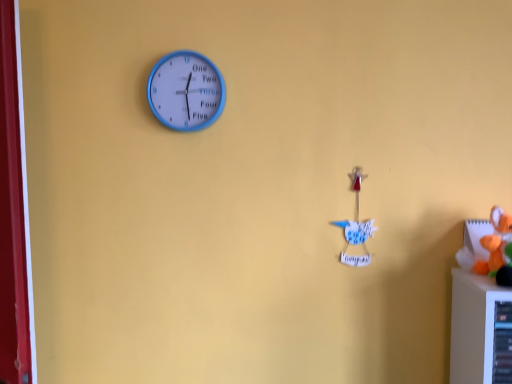
Question: Does blue plastic clock at upper left have a lesser width compared to white paper bird at center-right, which is counted as the first toy, starting from the left?

Choices:
 (A) yes
 (B) no

Answer: (A)

Question: Does blue plastic clock at upper left have a smaller size compared to white paper bird at center-right, the 1th toy in the back-to-front sequence?

Choices:
 (A) yes
 (B) no

Answer: (B)

Question: From the image's perspective, is blue plastic clock at upper left located above white paper bird at center-right, acting as the 2th toy starting from the right?

Choices:
 (A) no
 (B) yes

Answer: (B)

Question: Are blue plastic clock at upper left and white paper bird at center-right, the 1th toy in the back-to-front sequence, located far from each other?

Choices:
 (A) no
 (B) yes

Answer: (A)

Question: Are blue plastic clock at upper left and white paper bird at center-right, acting as the 2th toy starting from the right, making contact?

Choices:
 (A) yes
 (B) no

Answer: (B)

Question: Is blue plastic clock at upper left to the left or to the right of white paper bird at center-right, the 1th toy in the back-to-front sequence, in the image?

Choices:
 (A) left
 (B) right

Answer: (A)

Question: From a real-world perspective, is blue plastic clock at upper left physically located above or below white paper bird at center-right, acting as the 2th toy starting from the right?

Choices:
 (A) above
 (B) below

Answer: (A)

Question: Considering the positions of blue plastic clock at upper left and white paper bird at center-right, which is counted as the first toy, starting from the left, in the image, is blue plastic clock at upper left taller or shorter than white paper bird at center-right, which is counted as the first toy, starting from the left,?

Choices:
 (A) short
 (B) tall

Answer: (A)

Question: Looking at the image, does blue plastic clock at upper left seem bigger or smaller compared to white paper bird at center-right, which is counted as the first toy, starting from the left?

Choices:
 (A) big
 (B) small

Answer: (A)

Question: Considering the positions of blue plastic clock at upper left and orange plush toy at right, which ranks as the 1th toy in right-to-left order, in the image, is blue plastic clock at upper left bigger or smaller than orange plush toy at right, which ranks as the 1th toy in right-to-left order,?

Choices:
 (A) small
 (B) big

Answer: (A)

Question: Based on their positions, is blue plastic clock at upper left located to the left or right of orange plush toy at right, the second toy in the left-to-right sequence?

Choices:
 (A) right
 (B) left

Answer: (B)

Question: In the image, is blue plastic clock at upper left positioned in front of or behind orange plush toy at right, the second toy in the left-to-right sequence?

Choices:
 (A) front
 (B) behind

Answer: (B)

Question: From their relative heights in the image, would you say blue plastic clock at upper left is taller or shorter than orange plush toy at right, which appears as the second toy when viewed from the back?

Choices:
 (A) short
 (B) tall

Answer: (B)

Question: In terms of width, does white paper bird at center-right, the 1th toy in the back-to-front sequence, look wider or thinner when compared to blue plastic clock at upper left?

Choices:
 (A) wide
 (B) thin

Answer: (A)

Question: Is point (353, 228) positioned closer to the camera than point (180, 61)?

Choices:
 (A) farther
 (B) closer

Answer: (A)